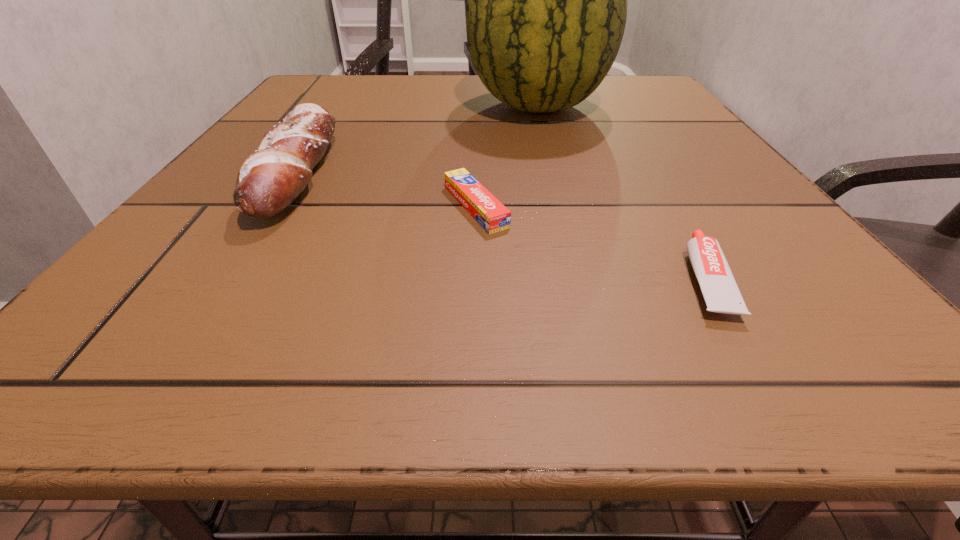
This screenshot has height=540, width=960. Identify the location of the tallest object. (546, 12).

Where is `the third shortest object`? the third shortest object is located at coordinates (269, 180).

Identify the location of the leftmost object. (269, 180).

At what (x,y) coordinates should I click in order to perform the action: click on the right toothpaste. Please return your answer as a coordinate pair (x, y). Looking at the image, I should click on (720, 291).

Where is `the nearest object`? The image size is (960, 540). the nearest object is located at coordinates (720, 291).

Locate an element on the screen. the farther toothpaste is located at coordinates (485, 208).

Where is `the shorter toothpaste`? This screenshot has width=960, height=540. the shorter toothpaste is located at coordinates (485, 208).

In order to click on free space located 0.050m on the front of the watermelon in this screenshot , I will do `click(548, 146)`.

Identify the location of vacant space located 0.310m on the back of the second tallest object. The height and width of the screenshot is (540, 960). (359, 79).

Locate an element on the screen. free point located 0.080m on the back of the nearer toothpaste is located at coordinates (664, 210).